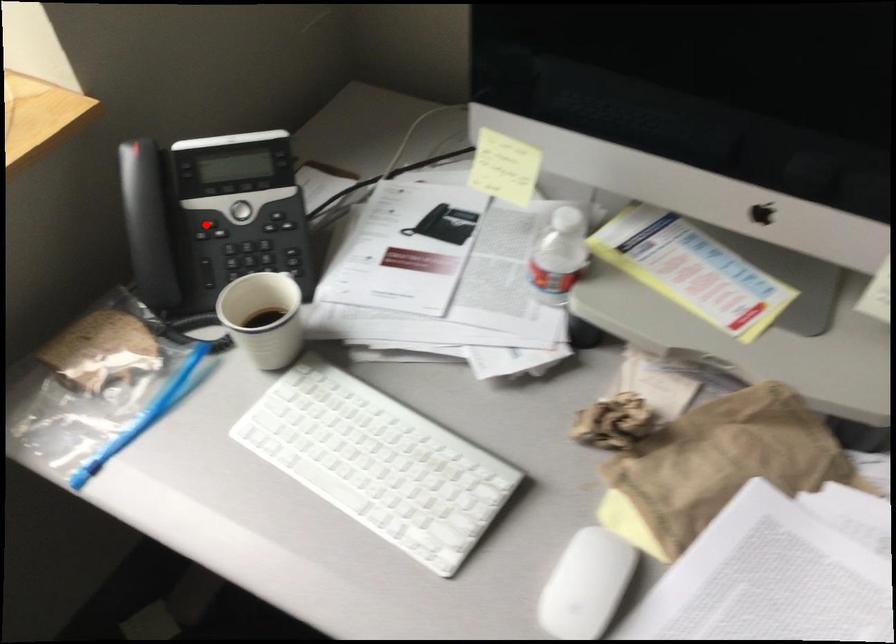
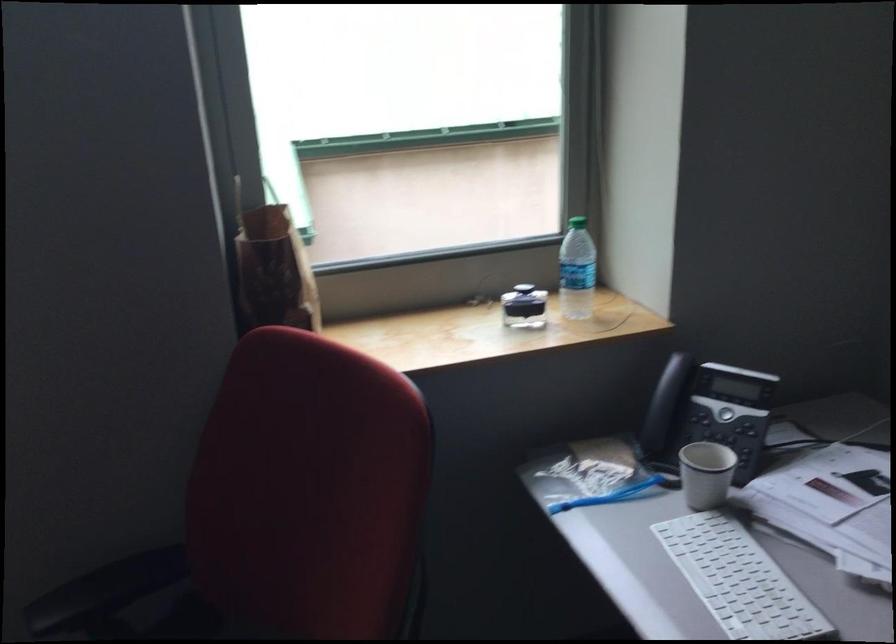
Question: I am providing you with two images of the same scene from different viewpoints. Given a red point in image1, look at the same physical point in image2. Is it:

Choices:
 (A) Closer to the viewpoint
 (B) Farther from the viewpoint

Answer: (B)